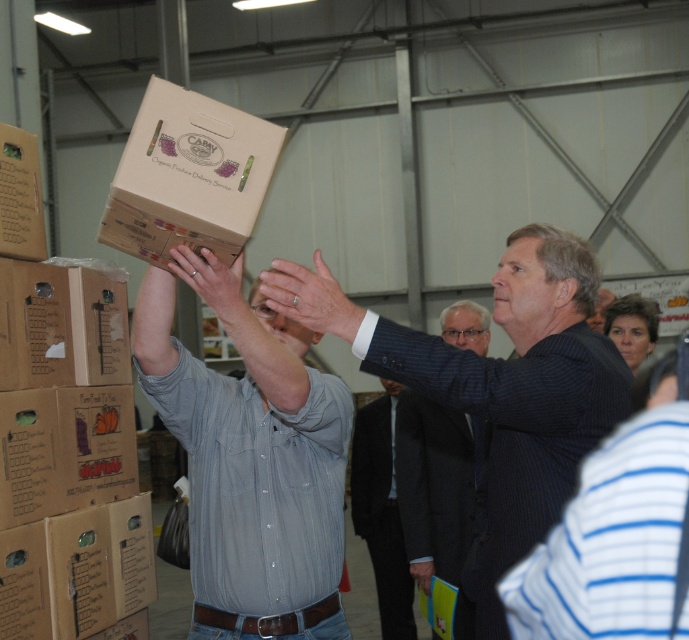
Measure the distance between point (418, 525) and camera.

Point (418, 525) and camera are 15.85 feet apart from each other.

Who is lower down, dark blue suit at center or matte brown cardboard box at upper left?

dark blue suit at center is below.

Which is behind, point (418, 470) or point (28, 168)?

Point (418, 470)

Locate an element on the screen. This screenshot has width=689, height=640. dark blue suit at center is located at coordinates (435, 493).

Between brown cardboard box at upper center and cardboard box at upper center, which one appears on the right side from the viewer's perspective?

From the viewer's perspective, brown cardboard box at upper center appears more on the right side.

Does brown cardboard box at upper center have a lesser width compared to cardboard box at upper center?

No, brown cardboard box at upper center is not thinner than cardboard box at upper center.

The image size is (689, 640). I want to click on brown cardboard box at upper center, so (187, 177).

The image size is (689, 640). In order to click on brown cardboard box at upper center in this screenshot , I will do `click(187, 177)`.

What do you see at coordinates (497, 384) in the screenshot? I see `dark blue suit at upper right` at bounding box center [497, 384].

Which is more to the left, dark blue suit at upper right or dark suit at center?

Positioned to the left is dark suit at center.

Describe the element at coordinates (497, 384) in the screenshot. The width and height of the screenshot is (689, 640). I see `dark blue suit at upper right` at that location.

Locate an element on the screen. The width and height of the screenshot is (689, 640). dark blue suit at upper right is located at coordinates (497, 384).